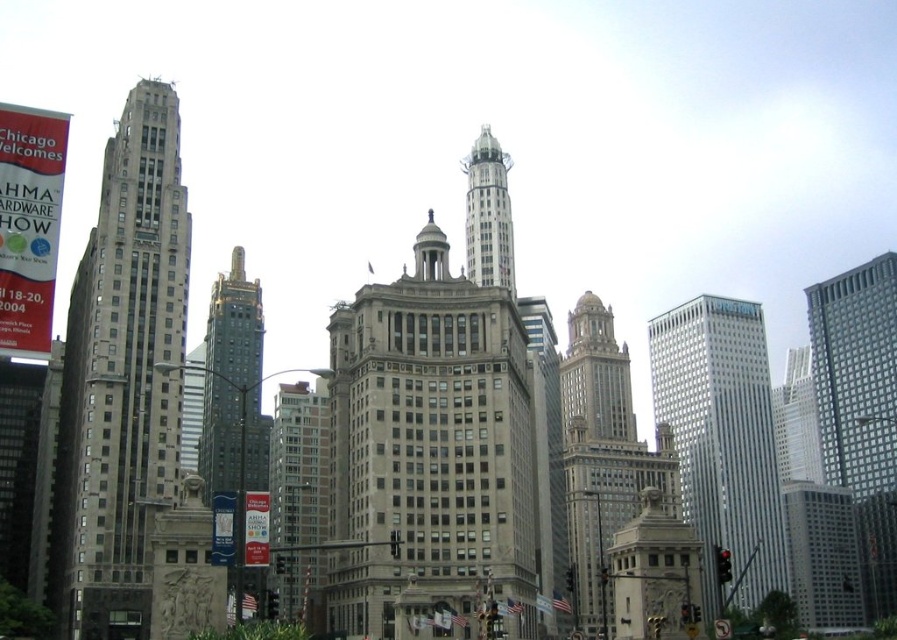
Question: Which is farther from the stone tower at center?

Choices:
 (A) white marble tower at center
 (B) silver glass skyscraper at right
 (C) brick textured building at center

Answer: (C)

Question: Which object is the closest to the brick textured building at center?

Choices:
 (A) silver glass skyscraper at right
 (B) white marble tower at center

Answer: (B)

Question: Is silver glass skyscraper at right thinner than gray glass skyscraper at right?

Choices:
 (A) yes
 (B) no

Answer: (B)

Question: Which point is closer to the camera?

Choices:
 (A) (780, 536)
 (B) (384, 497)
 (C) (86, 529)

Answer: (C)

Question: Is gray stone building at center positioned in front of brick textured building at center?

Choices:
 (A) yes
 (B) no

Answer: (A)

Question: Can you confirm if gray stone building at center is positioned below white marble tower at center?

Choices:
 (A) no
 (B) yes

Answer: (B)